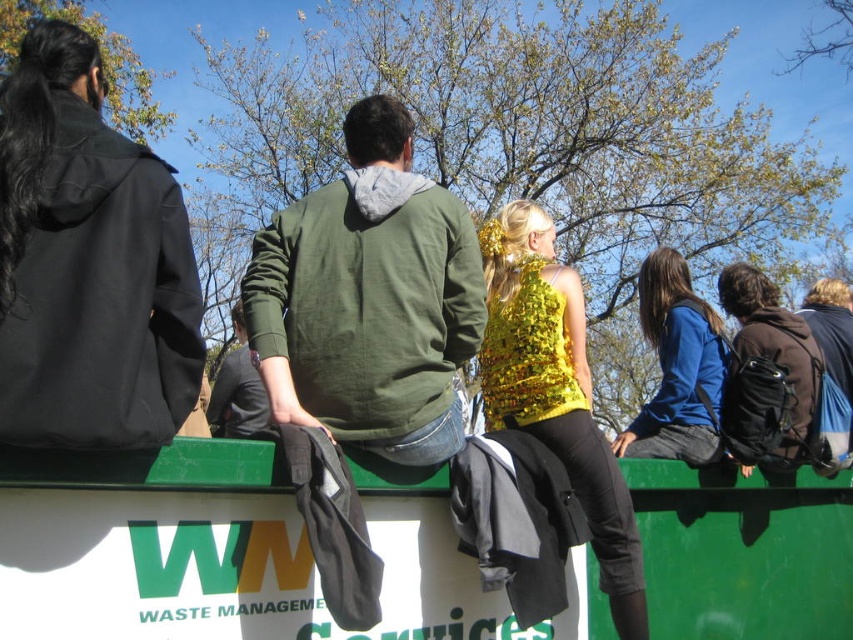
You are taking a photo of the scene and want to focus on both the point at location (495, 248) and the point at (695, 378). Since you can only focus on one point at a time, which point should you choose to ensure the other is still somewhat in focus?

You should focus on the point at (695, 378) because it is farther from the camera than the point at (495, 248). By focusing on the farther point, the closer point will still be within the depth of field and appear somewhat in focus.

You are a photographer at the event and want to capture a shot of the gold sequined top at center and the blue fabric jacket at center. Which one is positioned to the left?

The gold sequined top at center is to the left of the blue fabric jacket at center, so it is positioned to the left.

You are an artist observing the scene and want to paint the two central figures. Which clothing item, the gold sequined top at center or the blue fabric jacket at center, should you paint first if you want to depict them in the correct vertical order based on their heights?

The gold sequined top at center should be painted first because it has a greater height compared to the blue fabric jacket at center, meaning it is positioned lower in the painting to account for its taller stature.